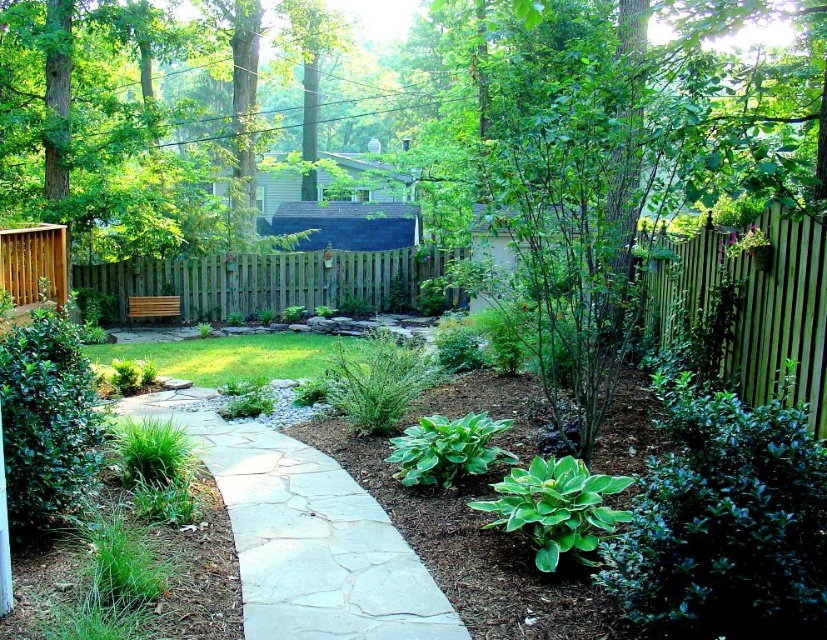
Question: Is the position of natural stone pathway at center less distant than that of green wooden fence at right?

Choices:
 (A) no
 (B) yes

Answer: (B)

Question: Is natural stone pathway at center further to camera compared to brown wood fence at center?

Choices:
 (A) yes
 (B) no

Answer: (B)

Question: Is green wooden fence at right to the right of brown wood fence at center from the viewer's perspective?

Choices:
 (A) yes
 (B) no

Answer: (A)

Question: Which is farther from the natural stone pathway at center?

Choices:
 (A) brown wood fence at center
 (B) green wooden fence at right

Answer: (A)

Question: Which point is farther from the camera taking this photo?

Choices:
 (A) (821, 376)
 (B) (125, 410)

Answer: (B)

Question: Which object is positioned closest to the natural stone pathway at center?

Choices:
 (A) green wooden fence at right
 (B) brown wood fence at center

Answer: (A)